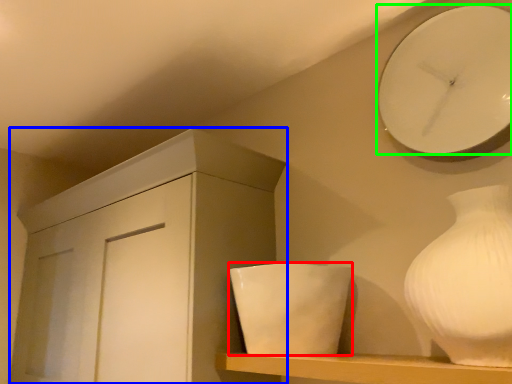
Question: Which is farther away from ceramic (highlighted by a red box)? cabinetry (highlighted by a blue box) or wall clock (highlighted by a green box)?

Choices:
 (A) cabinetry
 (B) wall clock

Answer: (B)